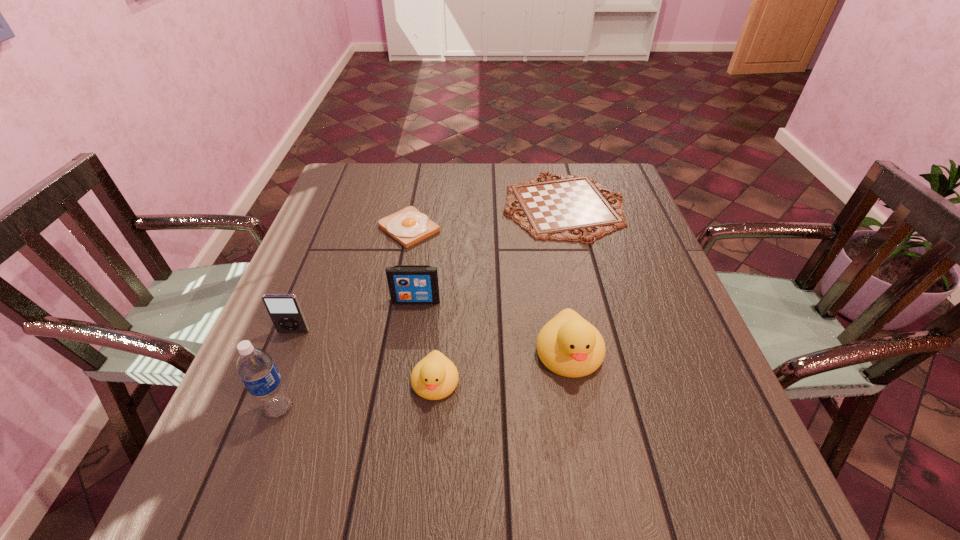
In the image, there is a desktop. Where is `vacant space at the far right corner`? vacant space at the far right corner is located at coordinates (622, 178).

I want to click on free space that is in between the taller duckling and the right iPod, so click(x=492, y=327).

Identify the location of free spot between the toast and the right duckling. (490, 291).

Locate an element on the screen. vacant point located between the farther iPod and the toast is located at coordinates (413, 265).

What are the coordinates of `vacant region between the chessboard and the taller duckling` in the screenshot? It's located at point(566,280).

Locate an element on the screen. The height and width of the screenshot is (540, 960). vacant region between the farther iPod and the toast is located at coordinates (413, 265).

Where is `vacant point located between the second shortest object and the water bottle`? The width and height of the screenshot is (960, 540). vacant point located between the second shortest object and the water bottle is located at coordinates (344, 319).

Identify the location of free space between the right duckling and the fifth tallest object. (502, 368).

This screenshot has height=540, width=960. I want to click on empty space between the water bottle and the chessboard, so click(x=421, y=307).

This screenshot has width=960, height=540. In order to click on empty location between the nearer iPod and the taller duckling in this screenshot , I will do `click(431, 343)`.